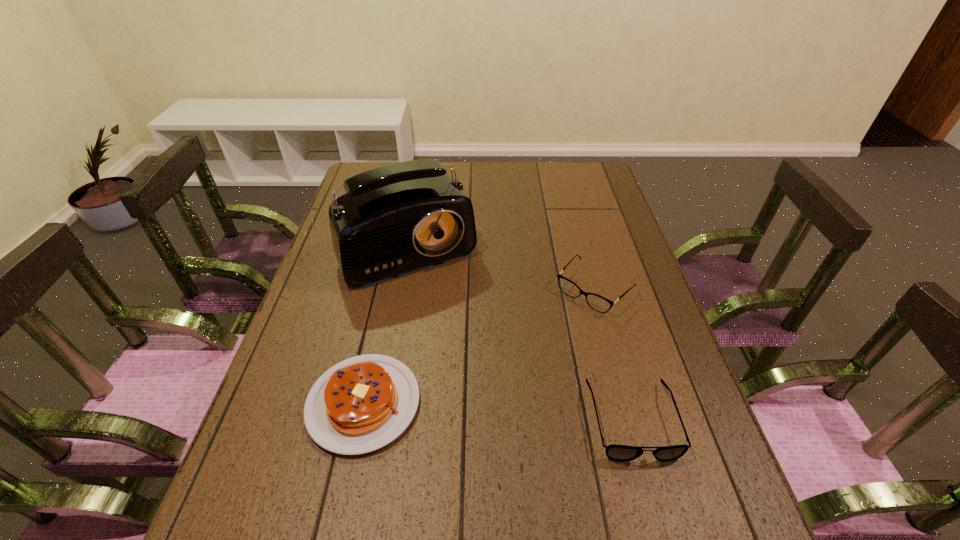
Find the location of a particular element. vacant spot on the desktop that is between the pancake and the nearer spectacles and is positioned on the front-facing side of the tallest object is located at coordinates (511, 413).

At what (x,y) coordinates should I click in order to perform the action: click on vacant space on the desktop that is between the pancake and the nearer spectacles and is positioned on the front-facing side of the farther spectacles. Please return your answer as a coordinate pair (x, y). Looking at the image, I should click on (481, 410).